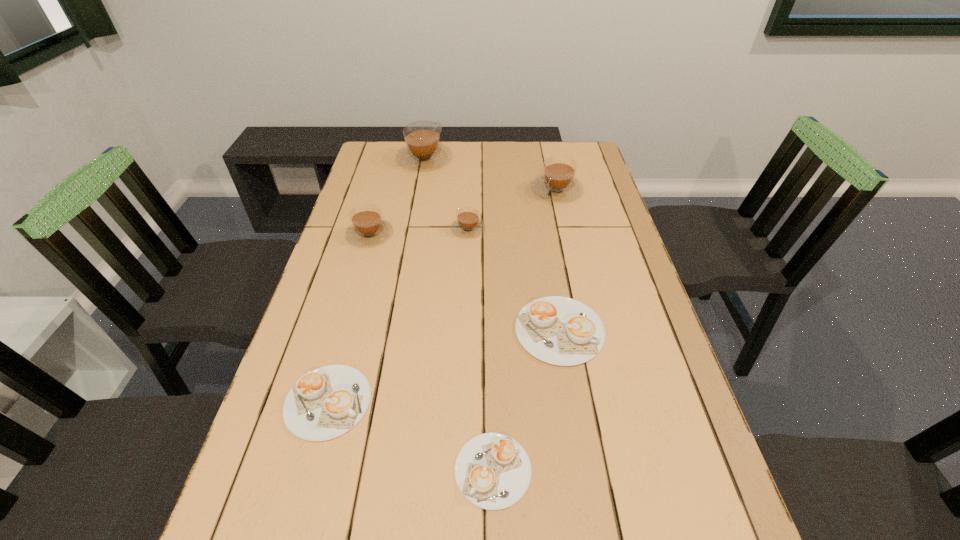
This screenshot has width=960, height=540. Identify the location of vacant region between the farthest brown cappuccino and the fifth tallest cappuccino. (492, 245).

This screenshot has width=960, height=540. I want to click on vacant space that is in between the biggest white cappuccino and the leftmost white cappuccino, so click(x=444, y=366).

You are a GUI agent. You are given a task and a screenshot of the screen. Output one action in this format:
    pyautogui.click(x=<x>, y=<y>)
    Task: Click on the empty location between the rightmost brown cappuccino and the third shortest cappuccino
    
    Given the screenshot: What is the action you would take?
    pyautogui.click(x=559, y=260)

Locate an element on the screen. Image resolution: width=960 pixels, height=540 pixels. vacant space in between the fourth shortest object and the third biggest brown cappuccino is located at coordinates (419, 232).

Find the location of a particular element. The image size is (960, 540). vacant area between the second brown cappuccino from right to left and the shortest object is located at coordinates (481, 349).

Identify which object is the second nearest to the fifth shortest cappuccino. Please provide its 2D coordinates. Your answer should be formatted as a tuple, i.e. [(x, y)], where the tuple contains the x and y coordinates of a point satisfying the conditions above.

[(423, 150)]

This screenshot has width=960, height=540. In order to click on object that stands as the closest to the rightmost brown cappuccino in this screenshot , I will do `click(467, 224)`.

Select which cappuccino appears as the fifth closest to the second farthest cappuccino. Please provide its 2D coordinates. Your answer should be formatted as a tuple, i.e. [(x, y)], where the tuple contains the x and y coordinates of a point satisfying the conditions above.

[(325, 403)]

Locate an element on the screen. Image resolution: width=960 pixels, height=540 pixels. cappuccino that is the second closest to the smallest brown cappuccino is located at coordinates (558, 183).

At what (x,y) coordinates should I click in order to perform the action: click on brown cappuccino that is the nearest to the sixth tallest object. Please return your answer as a coordinate pair (x, y). Image resolution: width=960 pixels, height=540 pixels. Looking at the image, I should click on (368, 228).